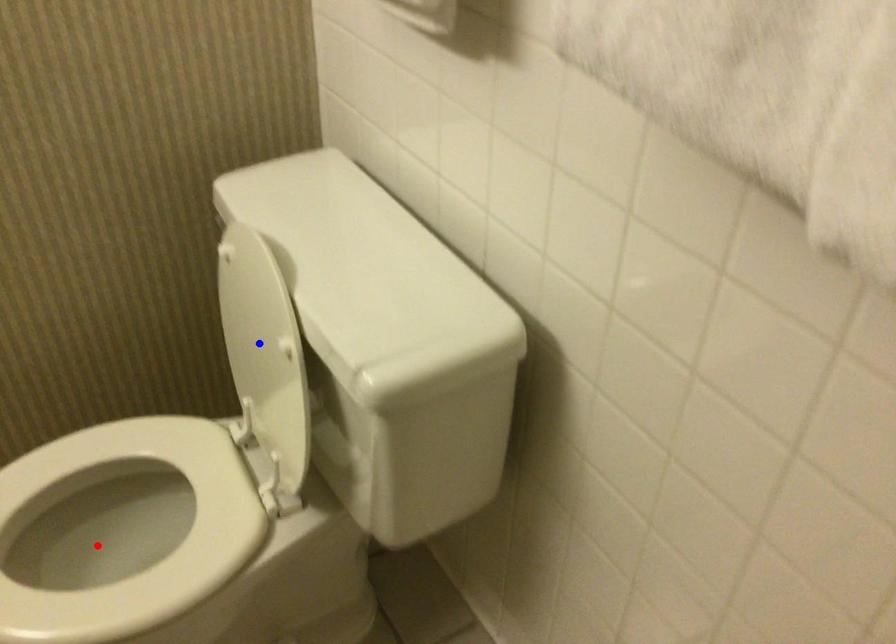
Question: Two points are marked on the image. Which point is closer to the camera?

Choices:
 (A) Blue point is closer.
 (B) Red point is closer.

Answer: (A)